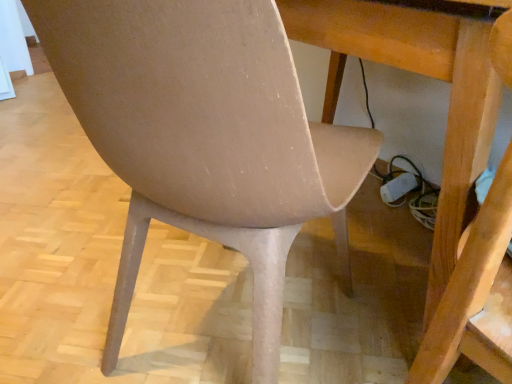
Find the location of a particular element. The image size is (512, 384). wooden table at center is located at coordinates (443, 164).

What are the coordinates of `matte beige chair at center` in the screenshot? It's located at (205, 136).

In the scene shown: From a real-world perspective, who is located lower, matte beige chair at center or matte beige swivel chair at lower left?

matte beige chair at center.

Does matte beige chair at center have a greater width compared to matte beige swivel chair at lower left?

Correct, the width of matte beige chair at center exceeds that of matte beige swivel chair at lower left.

Does point (162, 172) lie in front of point (504, 53)?

No, it is behind (504, 53).

What's the angular difference between wooden table at center and matte beige chair at center's facing directions?

159 degrees.

How far apart are wooden table at center and matte beige chair at center?

A distance of 11.67 inches exists between wooden table at center and matte beige chair at center.

Which is closer to the camera, (434, 272) or (273, 159)?

Point (434, 272) is positioned farther from the camera compared to point (273, 159).

Could you tell me if wooden table at center is turned towards matte beige chair at center?

Yes, wooden table at center is facing matte beige chair at center.

From the image's perspective, is wooden table at center located above or below matte beige swivel chair at lower left?

From the image's perspective, wooden table at center appears above matte beige swivel chair at lower left.

Is wooden table at center oriented towards matte beige swivel chair at lower left?

Yes, wooden table at center faces towards matte beige swivel chair at lower left.

The height and width of the screenshot is (384, 512). What are the coordinates of `table behind the matte beige swivel chair at lower left` in the screenshot? It's located at (443, 164).

Considering their positions, is wooden table at center located in front of or behind matte beige swivel chair at lower left?

Visually, wooden table at center is located behind matte beige swivel chair at lower left.

Is matte beige swivel chair at lower left in front of or behind wooden table at center in the image?

matte beige swivel chair at lower left is positioned closer to the viewer than wooden table at center.

In terms of size, does matte beige swivel chair at lower left appear bigger or smaller than wooden table at center?

Considering their sizes, matte beige swivel chair at lower left takes up less space than wooden table at center.

Is matte beige swivel chair at lower left located outside wooden table at center?

Actually, matte beige swivel chair at lower left is within wooden table at center.

From a real-world perspective, which object rests below the other?

In real-world perspective, matte beige chair at center is lower.

Is matte beige swivel chair at lower left situated inside matte beige chair at center or outside?

matte beige swivel chair at lower left lies outside matte beige chair at center.

Is point (460, 279) closer to viewer compared to point (189, 70)?

Yes, it is in front of point (189, 70).

Is matte beige swivel chair at lower left oriented away from matte beige chair at center?

No, matte beige chair at center is not at the back of matte beige swivel chair at lower left.

Who is more distant, matte beige chair at center or wooden table at center?

wooden table at center is more distant.

You are a GUI agent. You are given a task and a screenshot of the screen. Output one action in this format:
    pyautogui.click(x=<x>, y=<y>)
    Task: Click on the chair that appears on the left of wooden table at center
    The image size is (512, 384).
    Given the screenshot: What is the action you would take?
    pyautogui.click(x=205, y=136)

Is point (175, 79) less distant than point (294, 36)?

Yes, point (175, 79) is closer to viewer.

I want to click on chair on the left of matte beige swivel chair at lower left, so click(x=205, y=136).

This screenshot has height=384, width=512. I want to click on chair lying in front of the wooden table at center, so click(205, 136).

Estimate the real-world distances between objects in this image. Which object is further from wooden table at center, matte beige swivel chair at lower left or matte beige chair at center?

Based on the image, matte beige chair at center appears to be further to wooden table at center.

Estimate the real-world distances between objects in this image. Which object is further from matte beige chair at center, wooden table at center or matte beige swivel chair at lower left?

matte beige swivel chair at lower left is further to matte beige chair at center.

Based on their spatial positions, is matte beige chair at center or wooden table at center further from matte beige swivel chair at lower left?

matte beige chair at center is further to matte beige swivel chair at lower left.

Which object lies nearer to the anchor point matte beige chair at center, matte beige swivel chair at lower left or wooden table at center?

Based on the image, wooden table at center appears to be nearer to matte beige chair at center.

Which object lies nearer to the anchor point wooden table at center, matte beige chair at center or matte beige swivel chair at lower left?

matte beige swivel chair at lower left is closer to wooden table at center.

When comparing their distances from matte beige swivel chair at lower left, does wooden table at center or matte beige chair at center seem further?

Among the two, matte beige chair at center is located further to matte beige swivel chair at lower left.

Where is `chair between wooden table at center and matte beige swivel chair at lower left in the vertical direction`? The width and height of the screenshot is (512, 384). chair between wooden table at center and matte beige swivel chair at lower left in the vertical direction is located at coordinates (205, 136).